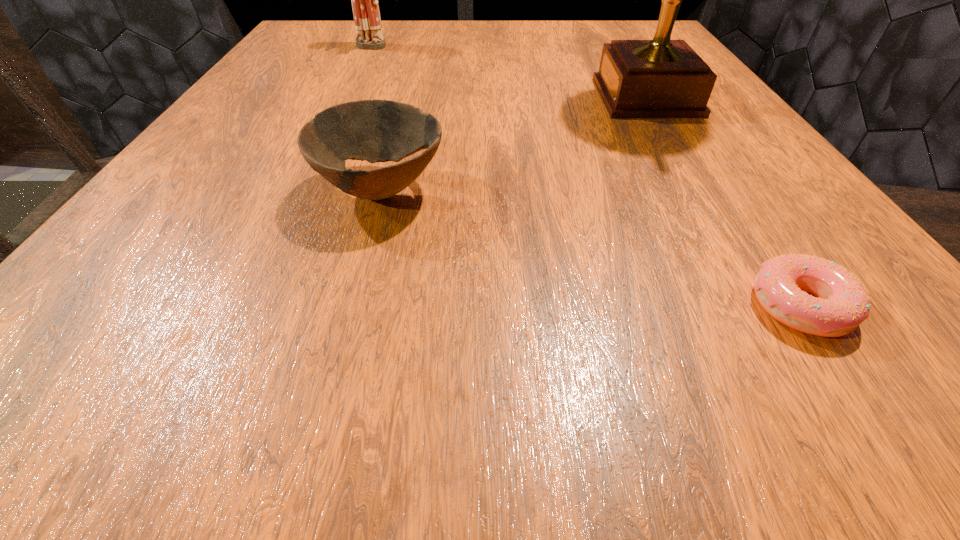
Locate an element on the screen. This screenshot has width=960, height=540. object that is positioned at the near right corner is located at coordinates (843, 303).

Find the location of `blank space at the far edge of the desktop`. blank space at the far edge of the desktop is located at coordinates (387, 32).

In the image, there is a desktop. Identify the location of free region at the near edge. (377, 400).

This screenshot has width=960, height=540. In order to click on free spot at the left edge of the desktop in this screenshot , I will do `click(236, 147)`.

In the image, there is a desktop. In order to click on vacant space at the right edge in this screenshot , I will do `click(728, 113)`.

The width and height of the screenshot is (960, 540). What are the coordinates of `vacant space at the far left corner of the desktop` in the screenshot? It's located at (333, 24).

In the image, there is a desktop. Where is `vacant space at the near right corner`? This screenshot has height=540, width=960. vacant space at the near right corner is located at coordinates (844, 381).

The height and width of the screenshot is (540, 960). What are the coordinates of `free spot between the third farthest object and the second farthest object` in the screenshot? It's located at (515, 143).

At what (x,y) coordinates should I click in order to perform the action: click on blank region between the tallest object and the third shortest object. Please return your answer as a coordinate pair (x, y). The image size is (960, 540). Looking at the image, I should click on (508, 72).

At what (x,y) coordinates should I click in order to perform the action: click on free space that is in between the third shortest object and the tallest object. Please return your answer as a coordinate pair (x, y). This screenshot has height=540, width=960. Looking at the image, I should click on pyautogui.click(x=508, y=72).